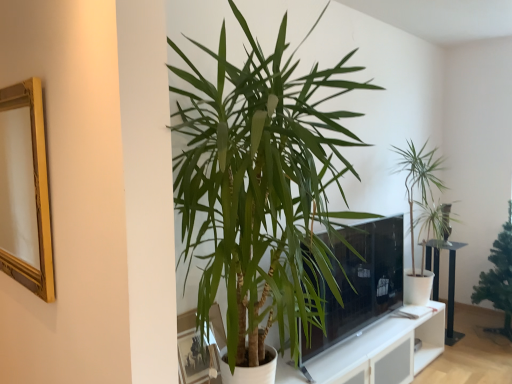
Question: Is matte glass picture frame at lower center, which appears as the 1th picture frame when ordered from the bottom, outside of gold wood picture frame at left, the 2th picture frame in the bottom-to-top sequence?

Choices:
 (A) yes
 (B) no

Answer: (A)

Question: Does matte glass picture frame at lower center, the 2th picture frame from the top, have a larger size compared to gold wood picture frame at left, positioned as the 2th picture frame in right-to-left order?

Choices:
 (A) no
 (B) yes

Answer: (A)

Question: Is matte glass picture frame at lower center, which appears as the 1th picture frame when ordered from the bottom, behind gold wood picture frame at left, arranged as the 1th picture frame when viewed from the top?

Choices:
 (A) yes
 (B) no

Answer: (A)

Question: From a real-world perspective, is matte glass picture frame at lower center, the 2th picture frame from the top, beneath gold wood picture frame at left, arranged as the 1th picture frame when viewed from the top?

Choices:
 (A) yes
 (B) no

Answer: (A)

Question: From the image's perspective, is matte glass picture frame at lower center, the 2th picture frame from the top, located above gold wood picture frame at left, arranged as the 1th picture frame when viewed from the left?

Choices:
 (A) no
 (B) yes

Answer: (A)

Question: Is matte glass picture frame at lower center, acting as the second picture frame starting from the left, positioned with its back to gold wood picture frame at left, arranged as the 1th picture frame when viewed from the left?

Choices:
 (A) no
 (B) yes

Answer: (A)

Question: Considering the relative sizes of black metal table at right and green leafy plant at center, which ranks as the first houseplant in front-to-back order, in the image provided, is black metal table at right shorter than green leafy plant at center, which ranks as the first houseplant in front-to-back order,?

Choices:
 (A) yes
 (B) no

Answer: (A)

Question: Does black metal table at right turn towards green leafy plant at center, which is the third houseplant in back-to-front order?

Choices:
 (A) no
 (B) yes

Answer: (A)

Question: Is black metal table at right at the right side of green leafy plant at center, arranged as the 1th houseplant when viewed from the left?

Choices:
 (A) yes
 (B) no

Answer: (A)

Question: Is black metal table at right beside green leafy plant at center, arranged as the 1th houseplant when viewed from the left?

Choices:
 (A) yes
 (B) no

Answer: (B)

Question: Is black metal table at right positioned behind green leafy plant at center, which is the 3th houseplant in right-to-left order?

Choices:
 (A) no
 (B) yes

Answer: (B)

Question: Is black metal table at right wider than green leafy plant at center, arranged as the 1th houseplant when viewed from the left?

Choices:
 (A) no
 (B) yes

Answer: (A)

Question: Is green leafy plant at right, which is the third houseplant from front to back, taller than gold wood picture frame at left, arranged as the 1th picture frame when viewed from the left?

Choices:
 (A) no
 (B) yes

Answer: (B)